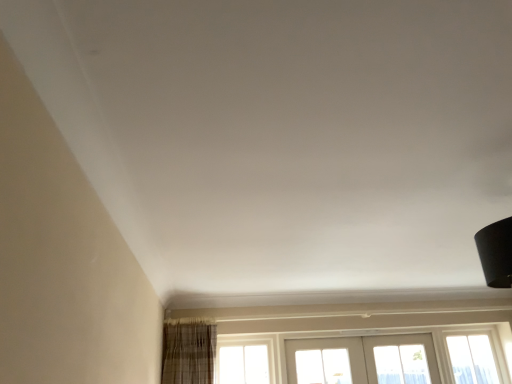
Question: Could you tell me if white painted wood screen door at lower center is turned towards clear glass window at lower right, the 2th window from the left?

Choices:
 (A) no
 (B) yes

Answer: (A)

Question: Is white painted wood screen door at lower center to the left of clear glass window at lower right, the 2th window from the left, from the viewer's perspective?

Choices:
 (A) yes
 (B) no

Answer: (A)

Question: Can you confirm if white painted wood screen door at lower center is shorter than clear glass window at lower right, placed as the 1th window when sorted from right to left?

Choices:
 (A) no
 (B) yes

Answer: (B)

Question: Could clear glass window at lower right, the 2th window from the left, be considered to be inside white painted wood screen door at lower center?

Choices:
 (A) no
 (B) yes

Answer: (A)

Question: Does white painted wood screen door at lower center have a smaller size compared to clear glass window at lower right, placed as the 1th window when sorted from right to left?

Choices:
 (A) yes
 (B) no

Answer: (B)

Question: Based on their sizes in the image, would you say clear glass window at center, placed as the 1th window when sorted from left to right, is bigger or smaller than white painted wood screen door at lower center?

Choices:
 (A) big
 (B) small

Answer: (B)

Question: From a real-world perspective, is clear glass window at center, marked as the second window in a right-to-left arrangement, positioned above or below white painted wood screen door at lower center?

Choices:
 (A) above
 (B) below

Answer: (A)

Question: In the image, is clear glass window at center, marked as the second window in a right-to-left arrangement, positioned in front of or behind white painted wood screen door at lower center?

Choices:
 (A) front
 (B) behind

Answer: (A)

Question: Is point (225, 370) positioned closer to the camera than point (334, 347)?

Choices:
 (A) closer
 (B) farther

Answer: (A)

Question: Is point (266, 382) positioned closer to the camera than point (492, 377)?

Choices:
 (A) farther
 (B) closer

Answer: (B)

Question: Considering the positions of clear glass window at center, placed as the 1th window when sorted from left to right, and clear glass window at lower right, placed as the 1th window when sorted from right to left, in the image, is clear glass window at center, placed as the 1th window when sorted from left to right, bigger or smaller than clear glass window at lower right, placed as the 1th window when sorted from right to left,?

Choices:
 (A) small
 (B) big

Answer: (A)

Question: Choose the correct answer: Is clear glass window at center, placed as the 1th window when sorted from left to right, inside clear glass window at lower right, the 2th window from the left, or outside it?

Choices:
 (A) inside
 (B) outside

Answer: (B)

Question: Based on their positions, is clear glass window at center, placed as the 1th window when sorted from left to right, located to the left or right of clear glass window at lower right, the 2th window from the left?

Choices:
 (A) left
 (B) right

Answer: (A)

Question: From the image's perspective, is clear glass window at lower right, the 2th window from the left, located above or below white painted wood screen door at lower center?

Choices:
 (A) below
 (B) above

Answer: (A)

Question: Which is correct: clear glass window at lower right, placed as the 1th window when sorted from right to left, is inside white painted wood screen door at lower center, or outside of it?

Choices:
 (A) outside
 (B) inside

Answer: (A)